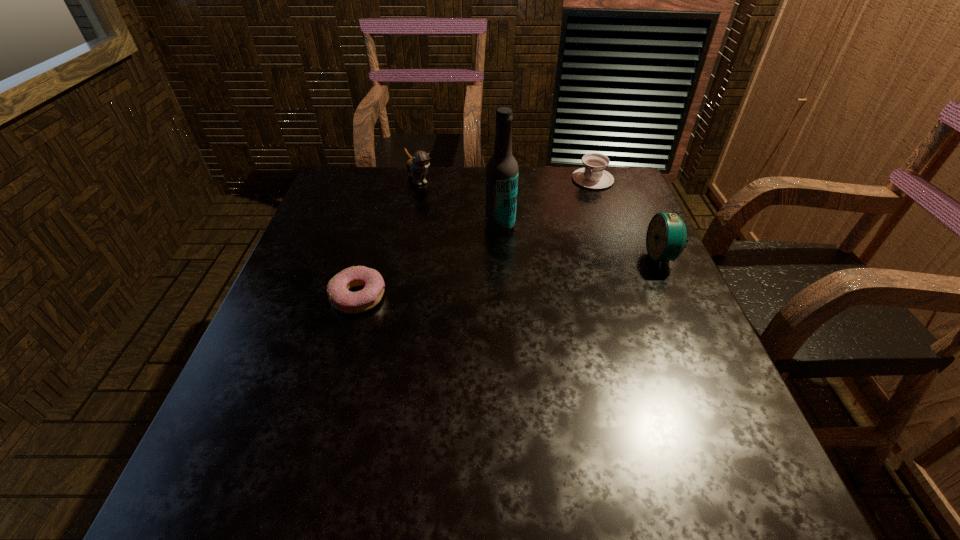
This screenshot has height=540, width=960. In order to click on free space on the desktop that is between the doughnut and the alarm clock and is positioned on the side of the beer bottle with the label in this screenshot , I will do `click(472, 282)`.

In order to click on free space on the desktop that is between the shortest object and the fourth farthest object and is positioned on the front-facing side of the kitten in this screenshot , I will do `click(507, 277)`.

At what (x,y) coordinates should I click in order to perform the action: click on free spot on the desktop that is between the shortest object and the alarm clock and is positioned on the handle side of the teacup. Please return your answer as a coordinate pair (x, y). The height and width of the screenshot is (540, 960). Looking at the image, I should click on (545, 272).